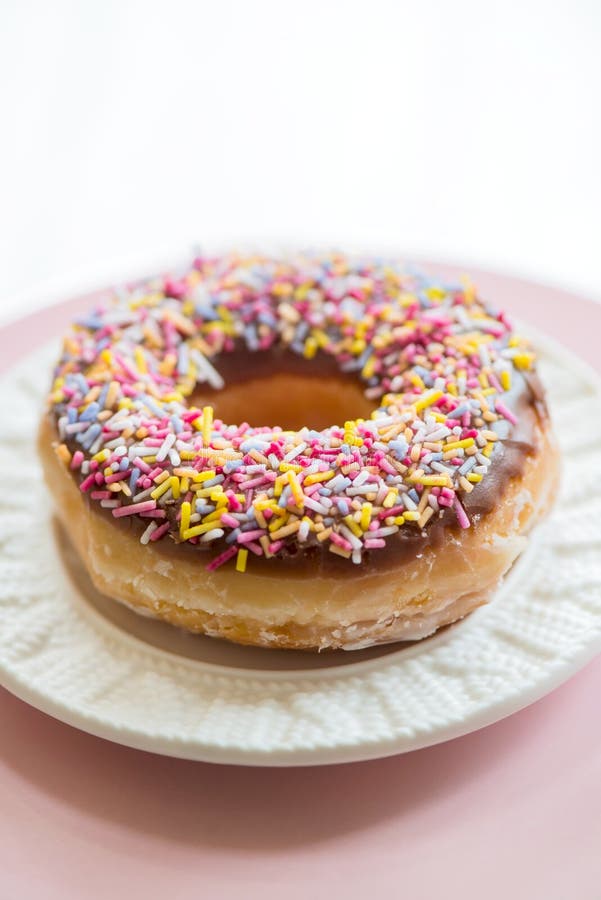
Where is `middle of plate`? Image resolution: width=601 pixels, height=900 pixels. middle of plate is located at coordinates (248, 662).